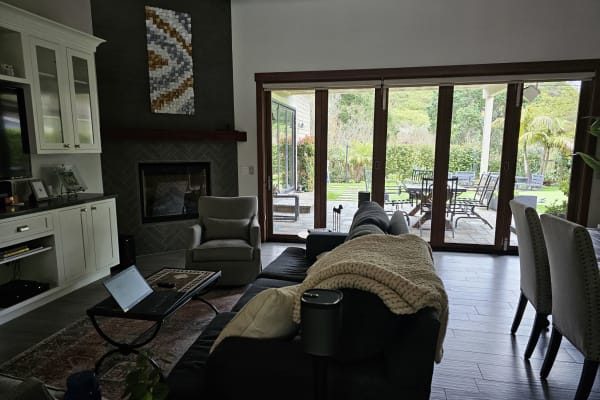
Find the location of a particular element. Image resolution: width=600 pixels, height=400 pixels. tv is located at coordinates (1, 142).